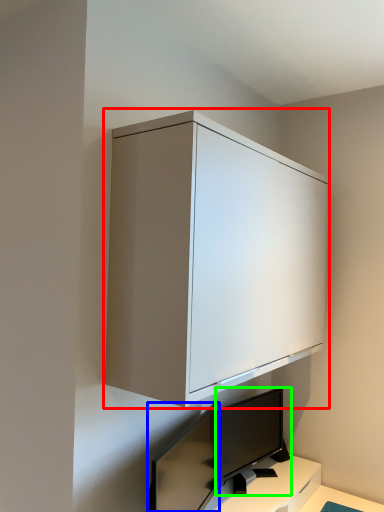
Question: Which object is positioned closest to cabinetry (highlighted by a red box)? Select from computer monitor (highlighted by a blue box) and computer monitor (highlighted by a green box).

Choices:
 (A) computer monitor
 (B) computer monitor

Answer: (B)